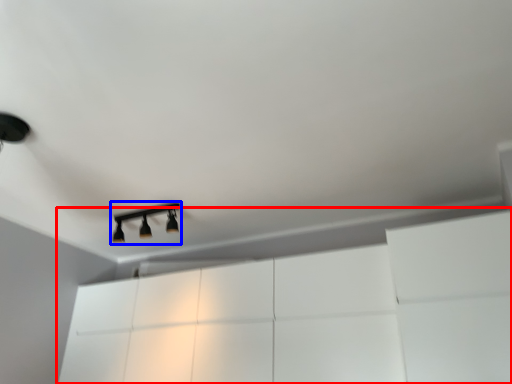
Question: Which object appears farthest to the camera in this image, dresser (highlighted by a red box) or lamp (highlighted by a blue box)?

Choices:
 (A) dresser
 (B) lamp

Answer: (B)